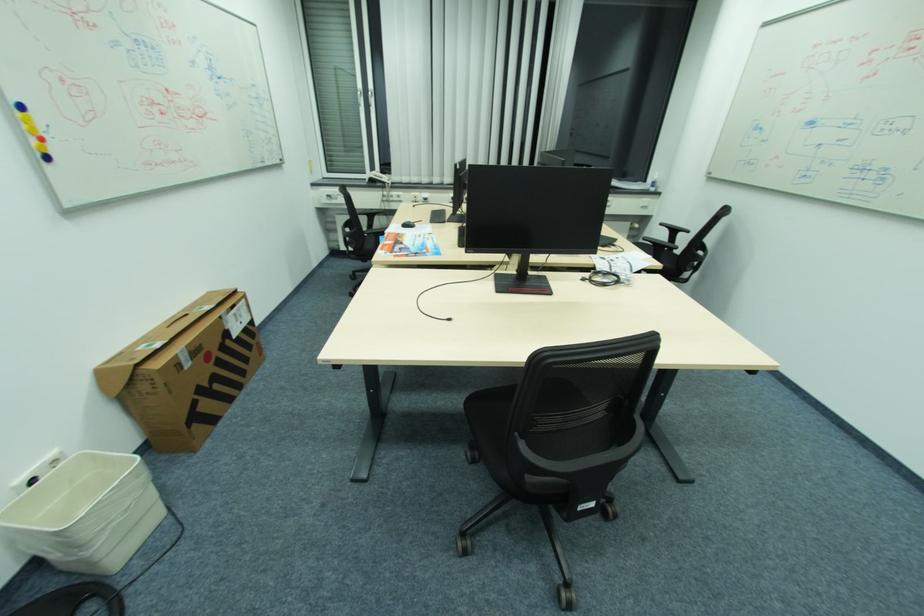
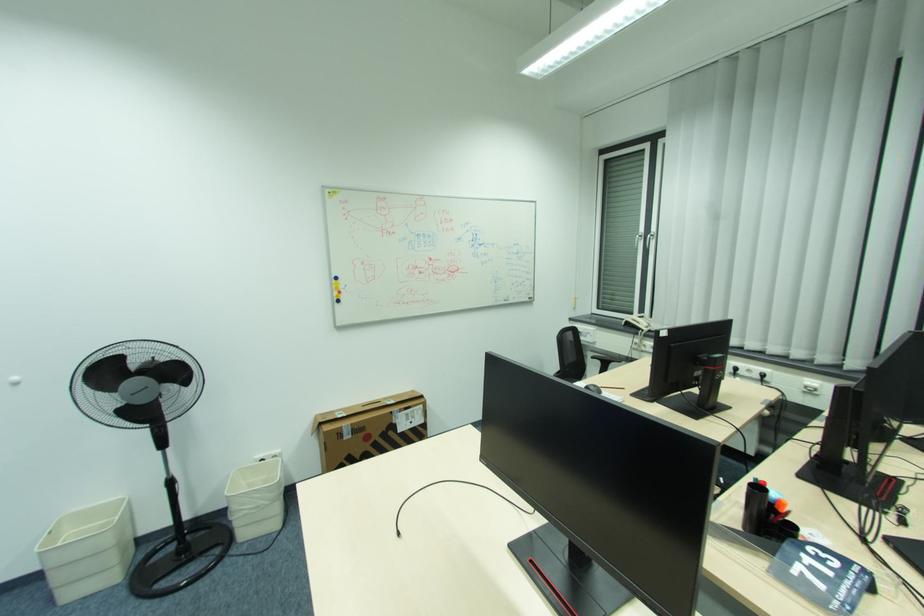
In the second image, find the point that corresponds to (181,355) in the first image.

(346, 427)